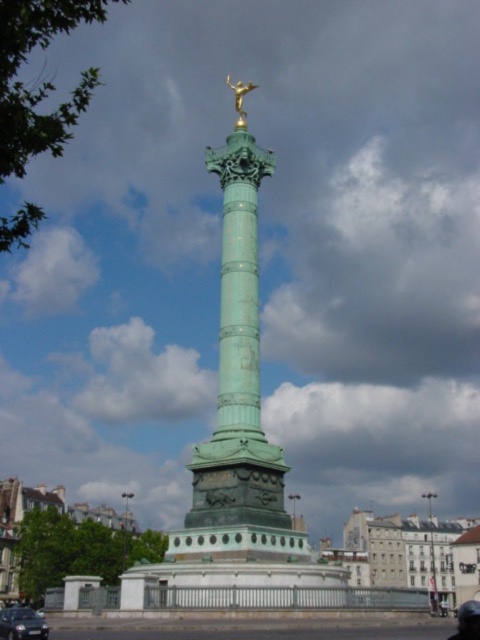
Question: Is green patina column at center bigger than goldmaterial/texturestatue at upper center?

Choices:
 (A) no
 (B) yes

Answer: (A)

Question: Which object is closer to the camera taking this photo?

Choices:
 (A) goldmaterial/texturestatue at upper center
 (B) green patina column at center
 (C) shiny black sedan at lower left

Answer: (C)

Question: Can you confirm if shiny black sedan at lower left is bigger than goldmaterial/texturestatue at upper center?

Choices:
 (A) no
 (B) yes

Answer: (A)

Question: Does green patina column at center come in front of goldmaterial/texturestatue at upper center?

Choices:
 (A) yes
 (B) no

Answer: (A)

Question: Which point is farther from the camera taking this photo?

Choices:
 (A) (241, 90)
 (B) (3, 611)
 (C) (243, 445)

Answer: (A)

Question: Estimate the real-world distances between objects in this image. Which object is farther from the goldmaterial/texturestatue at upper center?

Choices:
 (A) shiny black sedan at lower left
 (B) green patina column at center

Answer: (A)